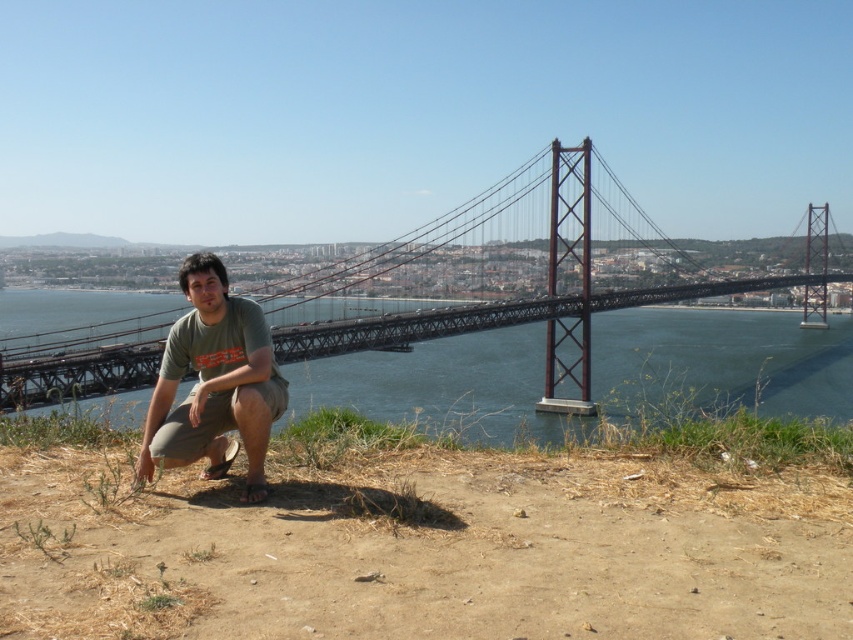
Question: Can you confirm if dark blue water at center is bigger than green cotton t-shirt at center?

Choices:
 (A) no
 (B) yes

Answer: (B)

Question: Is dark blue water at center above green cotton t-shirt at center?

Choices:
 (A) yes
 (B) no

Answer: (A)

Question: Does dark blue water at center have a lesser width compared to green cotton t-shirt at center?

Choices:
 (A) yes
 (B) no

Answer: (B)

Question: Estimate the real-world distances between objects in this image. Which object is closer to the dark blue water at center?

Choices:
 (A) green cotton t-shirt at center
 (B) metallic bridge at center

Answer: (B)

Question: Estimate the real-world distances between objects in this image. Which object is closer to the dark blue water at center?

Choices:
 (A) green cotton t-shirt at center
 (B) metallic bridge at center

Answer: (B)

Question: Which point is closer to the camera?

Choices:
 (A) (177, 342)
 (B) (332, 384)

Answer: (A)